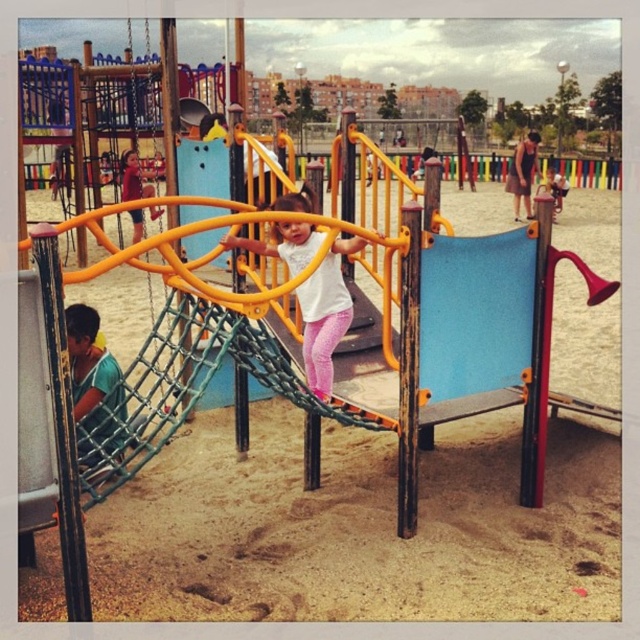
You are a photographer trying to capture a candid shot of the white matte shirt at center and the matte red shirt at upper left. Since you want both subjects to be in focus, you need to know if they are at the same height. Are they at the same height?

The white matte shirt at center is shorter than the matte red shirt at upper left, so they are not at the same height.

You are standing in the playground and want to place a new bench between the two points, point [509,321] and point [136,189]. Which point should the bench be closer to if you want it to be near the area where the children are playing?

The bench should be placed closer to point [136,189] because it is farther from the viewer, meaning it is likely located in the background where the children are playing, while point [509,321] is closer to the viewer and might be in the foreground where the main play structure is.